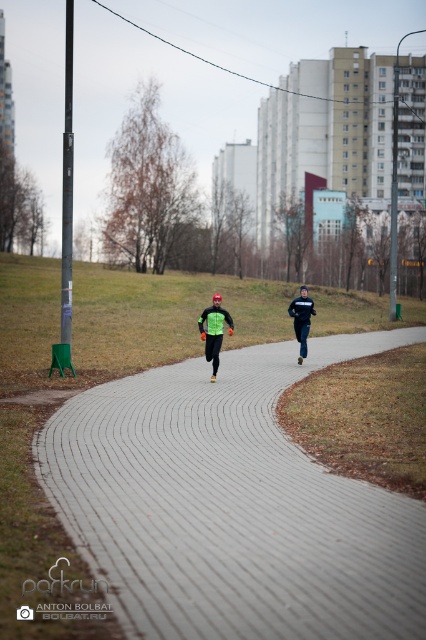
Based on the photo, you are planning to install a small bench on the gray brick pavement at center. According to the coordinates provided, where exactly should the bench be placed?

The gray brick pavement at center should have the bench placed at coordinates point (230, 506).

You are a drone operator trying to capture a photo of the joggers. The gray brick pavement at center and neon green fabric at center are both in your camera frame. Which object is closer to the camera?

The gray brick pavement at center is closer to the camera because it is in front of the neon green fabric at center.